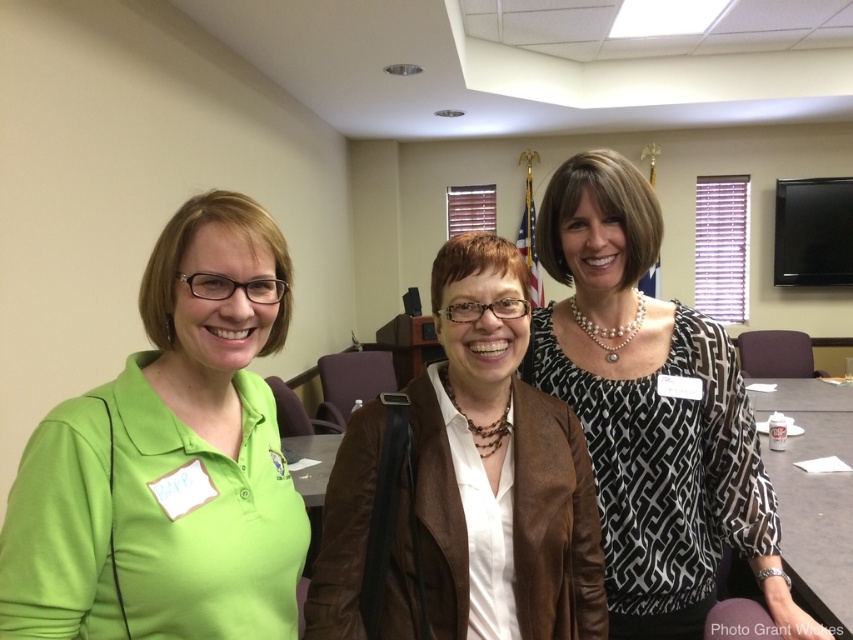
Does matte green polo shirt at left have a greater width compared to white paper at center?

No.

Looking at this image, between matte green polo shirt at left and white paper at center, which one appears on the right side from the viewer's perspective?

Positioned to the right is white paper at center.

The height and width of the screenshot is (640, 853). Identify the location of matte green polo shirt at left. (169, 460).

You are a GUI agent. You are given a task and a screenshot of the screen. Output one action in this format:
    pyautogui.click(x=<x>, y=<y>)
    Task: Click on the matte green polo shirt at left
    This screenshot has height=640, width=853.
    Given the screenshot: What is the action you would take?
    (169, 460)

Between point (606, 163) and point (805, 490), which one is positioned in front?

Positioned in front is point (606, 163).

Is black and white patterned blouse at center positioned at the back of white paper at center?

No, black and white patterned blouse at center is in front of white paper at center.

Locate an element on the screen. The image size is (853, 640). black and white patterned blouse at center is located at coordinates (651, 412).

Between matte green polo shirt at left and black and white patterned blouse at center, which one appears on the left side from the viewer's perspective?

matte green polo shirt at left

From the picture: Who is higher up, matte green polo shirt at left or black and white patterned blouse at center?

matte green polo shirt at left is higher up.

Describe the element at coordinates (169, 460) in the screenshot. This screenshot has width=853, height=640. I see `matte green polo shirt at left` at that location.

Identify the location of matte green polo shirt at left. The height and width of the screenshot is (640, 853). (169, 460).